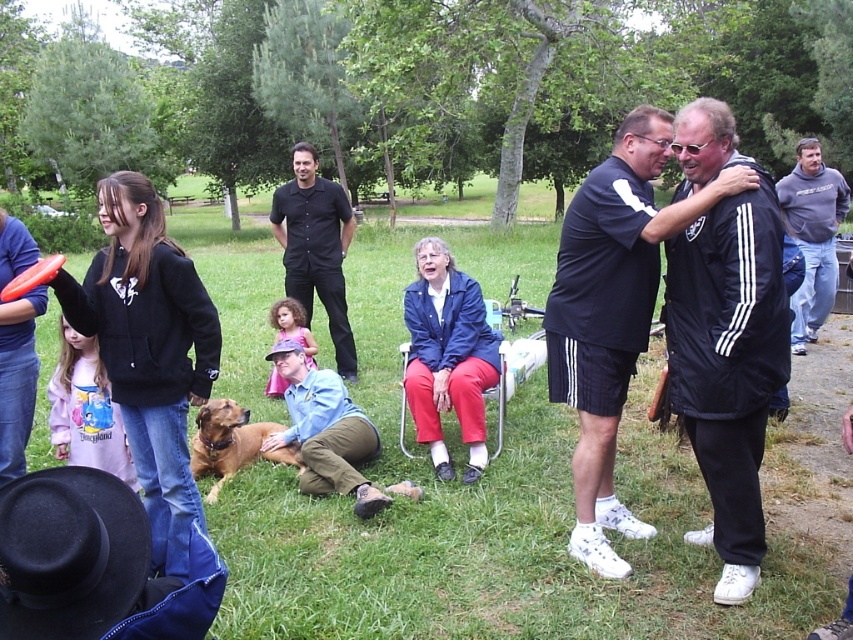
You are a photographer trying to capture a candid shot of the two subjects in the scene. The matte black hoodie at left and the black smooth shirt at center are both in your frame. If you want to ensure that the taller subject is fully visible without cropping, which subject should you focus on adjusting the camera angle for?

The matte black hoodie at left is taller than the black smooth shirt at center. To ensure the taller subject is fully visible, adjust the camera angle to account for the height difference, focusing on the matte black hoodie at left.

From the picture: You are organizing a picnic and need to pack both the blue fabric jacket at center and the orange matte frisbee at left. Which item will take up more space in your bag?

The orange matte frisbee at left takes up more space than the blue fabric jacket at center because the blue fabric jacket at center occupies less space than orange matte frisbee at left.